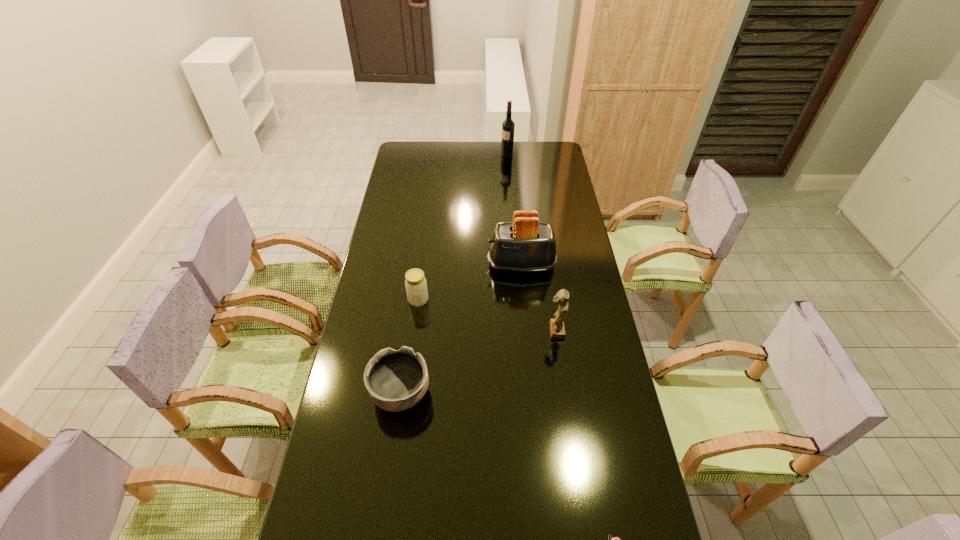
Find the location of `the farthest object`. the farthest object is located at coordinates (508, 126).

Locate an element on the screen. the second tallest object is located at coordinates (525, 245).

This screenshot has height=540, width=960. Find the location of `the fifth nearest object`. the fifth nearest object is located at coordinates (525, 245).

Identify the location of the third tallest object. This screenshot has width=960, height=540. (557, 329).

At what (x,y) coordinates should I click in order to perform the action: click on figurine. Please return your answer as a coordinate pair (x, y). The width and height of the screenshot is (960, 540). Looking at the image, I should click on (557, 329).

I want to click on the fourth nearest object, so click(416, 285).

The height and width of the screenshot is (540, 960). What are the coordinates of `pottery` in the screenshot? It's located at (396, 381).

Where is `vacant space located on the front and back of the wine bottle`? The image size is (960, 540). vacant space located on the front and back of the wine bottle is located at coordinates click(x=470, y=156).

Where is `vacant region located on the front and back of the wine bottle`? The width and height of the screenshot is (960, 540). vacant region located on the front and back of the wine bottle is located at coordinates (431, 156).

Find the location of a particular element. The height and width of the screenshot is (540, 960). free space located 0.170m on the front and back of the wine bottle is located at coordinates (468, 156).